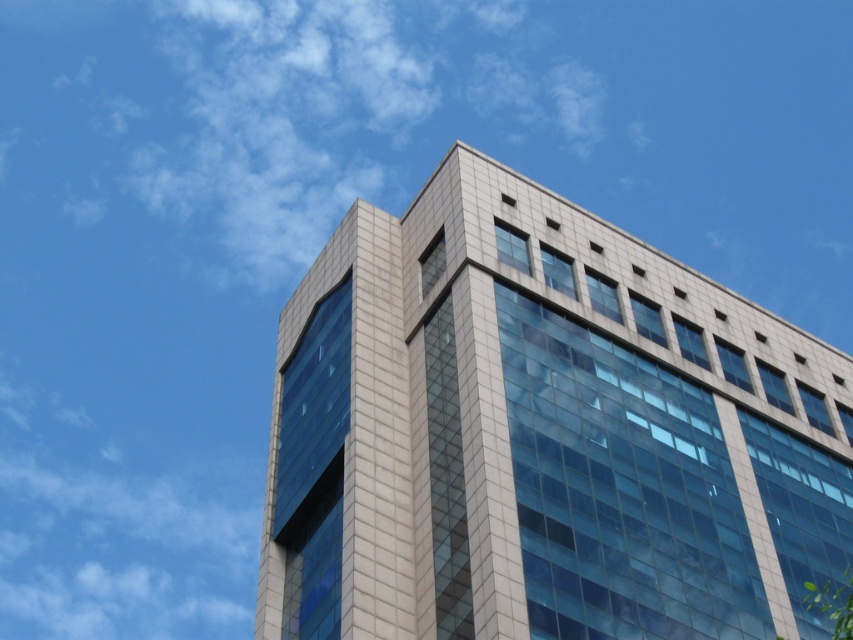
You are standing at the entrance of the gray tile building at center and want to walk to the green leafy tree at lower right. Which direction should you turn to face the tree?

The gray tile building at center is to the left of the green leafy tree at lower right, so you should turn to your right to face the tree.

You are a photographer planning to capture the gray tile building at center and the green leafy tree at lower right in a single shot. Based on their sizes, which one should you focus on to ensure both are visible without cropping?

The gray tile building at center is wider than the green leafy tree at lower right, so focusing on the building will ensure both are visible without cropping.

You are standing at the entrance of the gray tile building at center and want to see the green leafy tree at lower right. Can you see it clearly from your current position?

The green leafy tree at lower right is behind the gray tile building at center, so you cannot see it clearly from your current position.